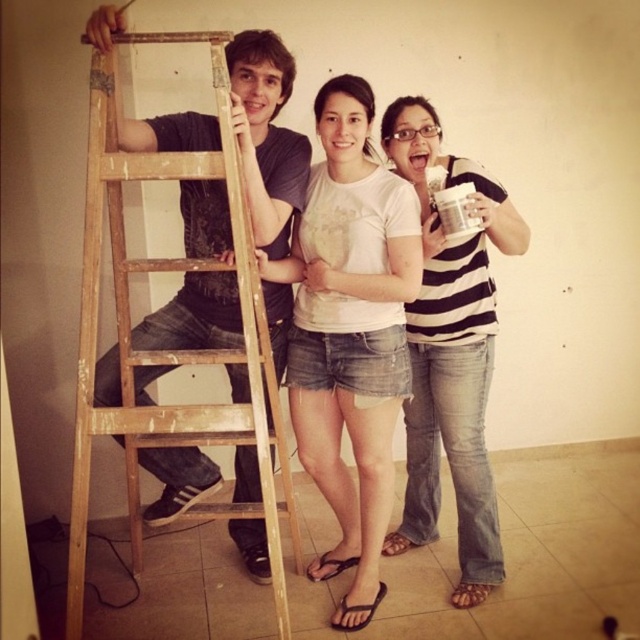
You are a painter needing to reach the top of the wooden ladder at left. There is a striped cotton shirt at center in your way. Which object do you need to move first to access the ladder?

The striped cotton shirt at center is closer to you than the wooden ladder at left, so you need to move the striped cotton shirt at center first to access the ladder.